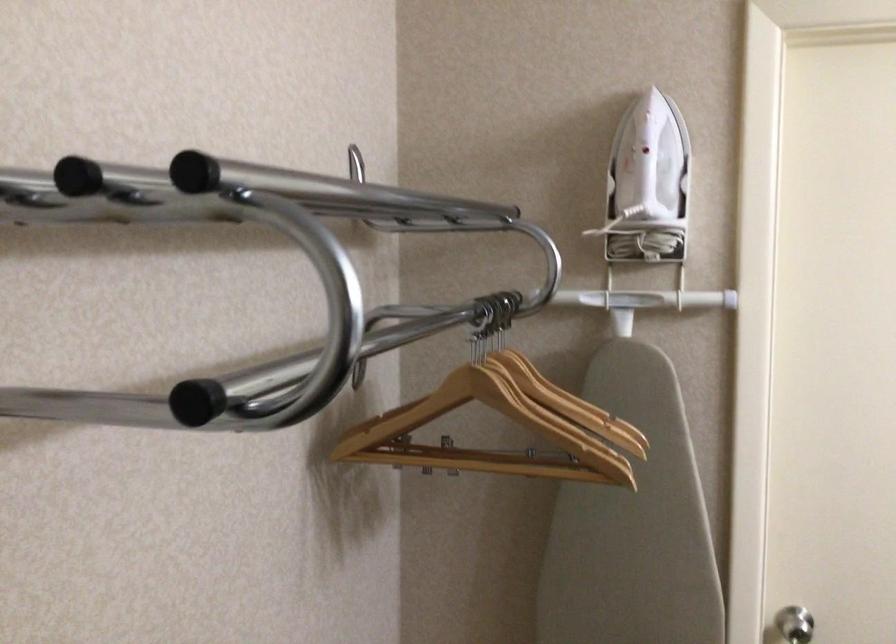
Find where to pull the silver door handle. Please return your answer as a coordinate pair (x, y).

(794, 625)